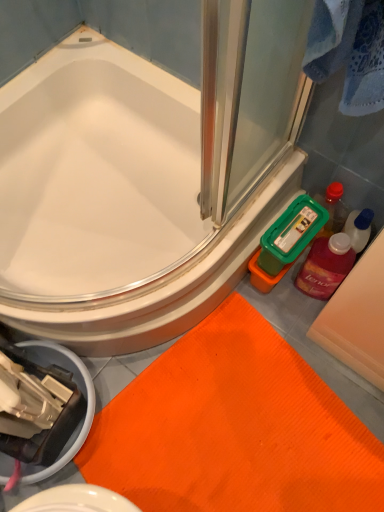
Locate an element on the screen. The width and height of the screenshot is (384, 512). vacant area on top of orange textured bath mat at lower center (from a real-world perspective) is located at coordinates tap(242, 432).